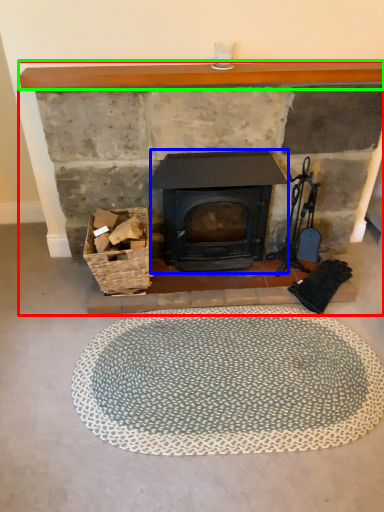
Question: Which object is the farthest from fireplace (highlighted by a red box)? Choose among these: wood burning stove (highlighted by a blue box) or balustrade (highlighted by a green box).

Choices:
 (A) wood burning stove
 (B) balustrade

Answer: (A)